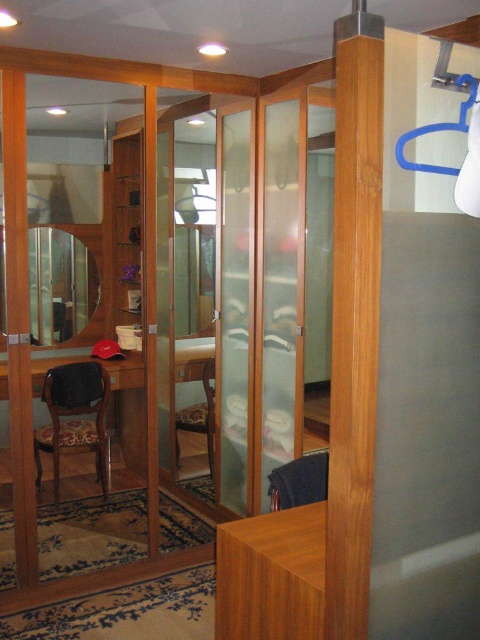
You are moving a 10 feet long ladder through the room. You need to pass between the clear plastic screen door at upper right and the wooden textured chair at left. Is there enough space for the ladder to fit through?

The clear plastic screen door at upper right and wooden textured chair at left are 9.33 feet apart. Since the ladder is 10 feet long, it is slightly longer than the available space, so the ladder will not fit through the gap between them.

You are arranging a small party in the room and need to place a 1.2 meter wide table. You have to decide between placing it near the clear plastic screen door at upper right or the wooden textured chair at left. Based on their positions, which location would allow the table to be closer to the center of the room?

The clear plastic screen door at upper right is to the right of the wooden textured chair at left. Since the table needs to be closer to the center, placing it near the wooden textured chair at left would position it closer to the center compared to the door which is further to the right.

You are trying to determine which object is taller between the clear plastic screen door at upper right and the matte wooden mirror at center. Based on the scene description, which one is taller?

The clear plastic screen door at upper right is taller than the matte wooden mirror at center according to the description.